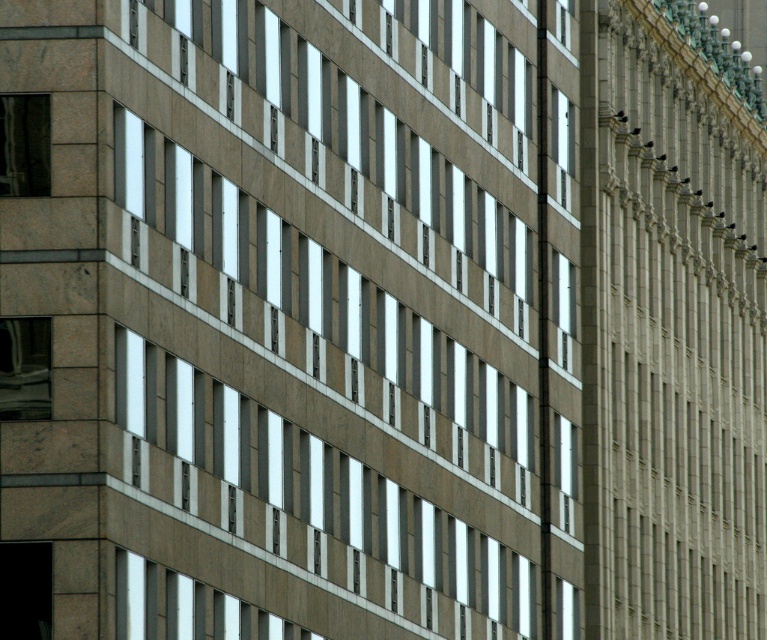
Question: Is clear glass window at upper center above clear glass window at center?

Choices:
 (A) no
 (B) yes

Answer: (B)

Question: Among these objects, which one is nearest to the camera?

Choices:
 (A) matte glass window at upper center
 (B) matte glass window at lower left
 (C) clear glass window at upper center
 (D) clear glass window at center

Answer: (B)

Question: Based on their relative distances, which object is nearer to the matte glass window at upper left?

Choices:
 (A) matte glass window at lower left
 (B) clear glass window at center

Answer: (A)

Question: Can you confirm if matte glass window at lower left is positioned below clear glass window at upper center?

Choices:
 (A) yes
 (B) no

Answer: (A)

Question: Which point appears closest to the camera in this image?

Choices:
 (A) (45, 122)
 (B) (571, 106)

Answer: (A)

Question: Is matte glass window at upper left to the right of clear glass window at center from the viewer's perspective?

Choices:
 (A) yes
 (B) no

Answer: (B)